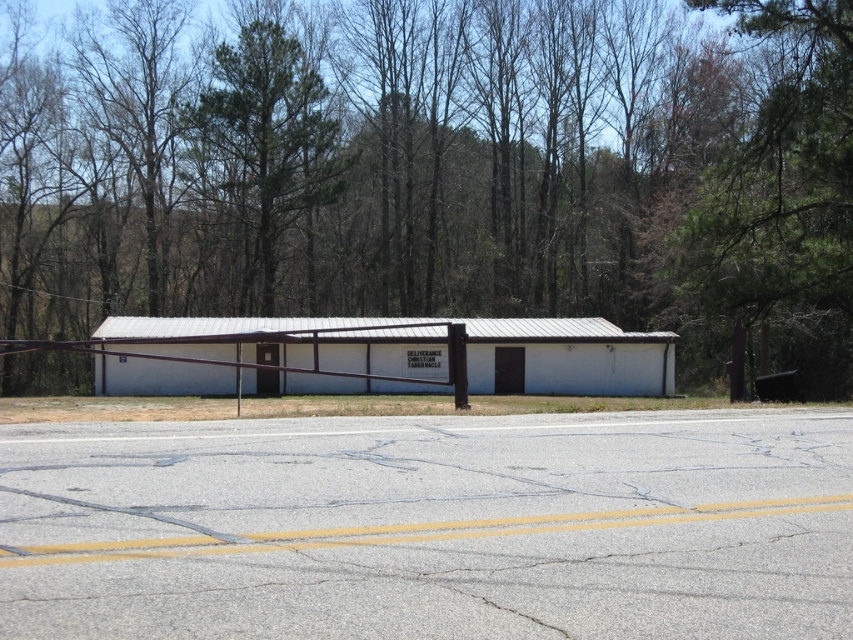
You are standing on the road in front of the building and want to walk to the green leafy tree at center. Which direction should you go to avoid the green leafy tree at upper center?

To avoid the green leafy tree at upper center, you should walk towards the green leafy tree at center, which is located lower than the green leafy tree at upper center. Since the green leafy tree at center has a larger size compared to green leafy tree at upper center, it is more prominent and easier to locate. Walk towards the larger tree to reach your destination without encountering the smaller one above it.

You are standing at the point closest to the building. Which point, point (47,125) or point (215,97), is farther away from you?

Point (47,125) is behind point (215,97), so it is farther away from you.